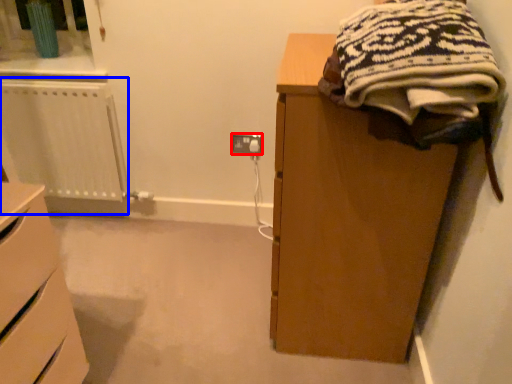
Question: Among these objects, which one is farthest to the camera, electric outlet (highlighted by a red box) or radiator (highlighted by a blue box)?

Choices:
 (A) electric outlet
 (B) radiator

Answer: (A)